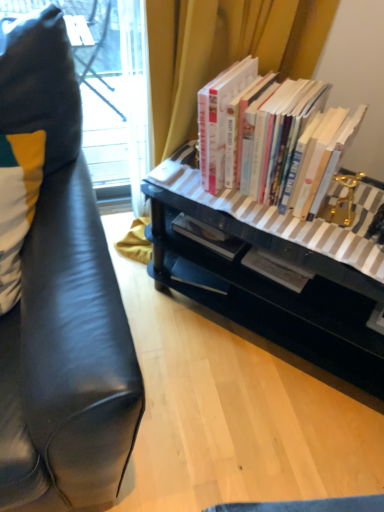
Question: From the image's perspective, relative to black glossy desk at center, is white and yellow fabric pillow at left above or below?

Choices:
 (A) below
 (B) above

Answer: (B)

Question: Considering the positions of white and yellow fabric pillow at left and black glossy desk at center in the image, is white and yellow fabric pillow at left taller or shorter than black glossy desk at center?

Choices:
 (A) tall
 (B) short

Answer: (B)

Question: Estimate the real-world distances between objects in this image. Which object is closer to the white and yellow fabric pillow at left?

Choices:
 (A) black glossy desk at center
 (B) hardcover books at center

Answer: (B)

Question: Considering the real-world distances, which object is closest to the hardcover books at center?

Choices:
 (A) black glossy desk at center
 (B) white and yellow fabric pillow at left

Answer: (A)